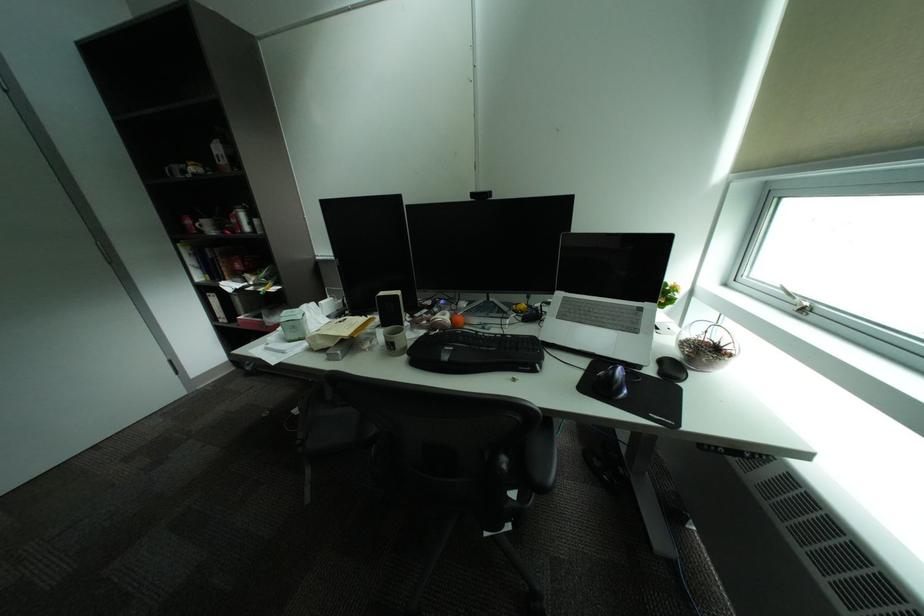
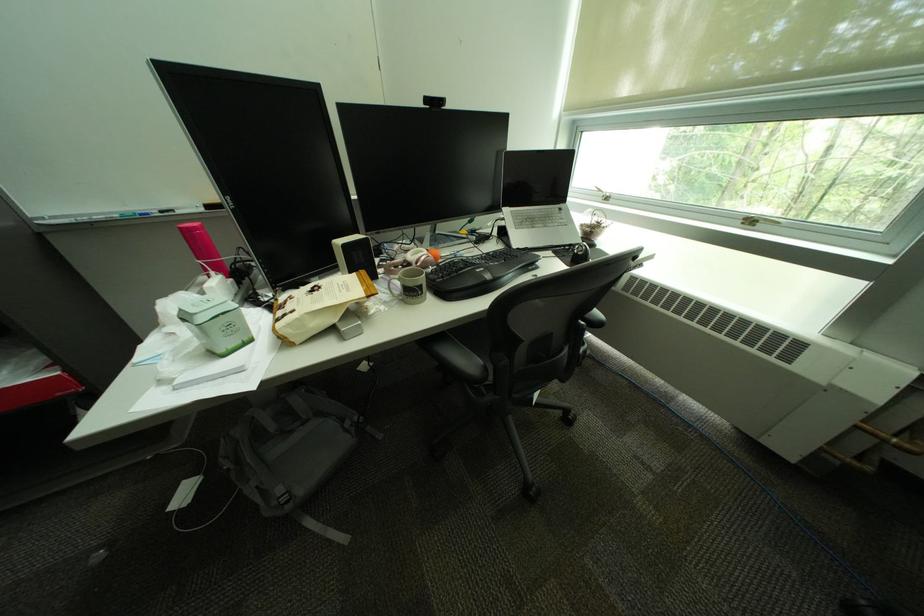
Question: I am providing you with two images of the same scene from different viewpoints. After the viewpoint changes to image2, which objects are now occluded?

Choices:
 (A) backpack top handle
 (B) black computer mouse
 (C) green tin container
 (D) none of these

Answer: (D)